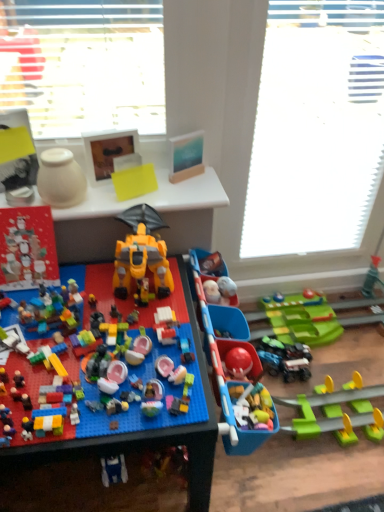
Question: Is yellow plastic robot at center, which appears as the 4th toy when viewed from the left, inside white matte vase at upper left, the second toy viewed from the left?

Choices:
 (A) no
 (B) yes

Answer: (A)

Question: Is white matte vase at upper left, the second toy viewed from the left, thinner than yellow plastic robot at center, which appears as the 4th toy when viewed from the left?

Choices:
 (A) yes
 (B) no

Answer: (A)

Question: Can we say white matte vase at upper left, the second toy viewed from the left, lies outside yellow plastic robot at center, acting as the second toy starting from the right?

Choices:
 (A) no
 (B) yes

Answer: (B)

Question: Is white matte vase at upper left, the second toy viewed from the left, positioned far away from yellow plastic robot at center, which appears as the 4th toy when viewed from the left?

Choices:
 (A) yes
 (B) no

Answer: (B)

Question: Is white matte vase at upper left, the second toy viewed from the left, in contact with yellow plastic robot at center, acting as the second toy starting from the right?

Choices:
 (A) no
 (B) yes

Answer: (A)

Question: From the image's perspective, is white matte vase at upper left, arranged as the 4th toy when viewed from the right, located above or below yellow plastic table at upper center?

Choices:
 (A) below
 (B) above

Answer: (B)

Question: Considering the relative positions of white matte vase at upper left, arranged as the 4th toy when viewed from the right, and yellow plastic table at upper center in the image provided, is white matte vase at upper left, arranged as the 4th toy when viewed from the right, to the left or to the right of yellow plastic table at upper center?

Choices:
 (A) right
 (B) left

Answer: (B)

Question: Considering the positions of point coord(41,174) and point coord(187,202), is point coord(41,174) closer or farther from the camera than point coord(187,202)?

Choices:
 (A) closer
 (B) farther

Answer: (A)

Question: In terms of size, does white matte vase at upper left, arranged as the 4th toy when viewed from the right, appear bigger or smaller than yellow plastic table at upper center?

Choices:
 (A) small
 (B) big

Answer: (A)

Question: Would you say white textured window screen at upper center is inside or outside translucent plastic spaceship at center, the 3th toy in the left-to-right sequence?

Choices:
 (A) inside
 (B) outside

Answer: (B)

Question: From a real-world perspective, is white textured window screen at upper center above or below translucent plastic spaceship at center, arranged as the third toy when viewed from the right?

Choices:
 (A) above
 (B) below

Answer: (A)

Question: Considering the positions of point (345, 113) and point (193, 408), is point (345, 113) closer or farther from the camera than point (193, 408)?

Choices:
 (A) farther
 (B) closer

Answer: (A)

Question: From the image's perspective, is white textured window screen at upper center above or below translucent plastic spaceship at center, the 3th toy in the left-to-right sequence?

Choices:
 (A) below
 (B) above

Answer: (B)

Question: Is yellow plastic robot at center, acting as the second toy starting from the right, inside or outside of white textured window screen at upper center?

Choices:
 (A) outside
 (B) inside

Answer: (A)

Question: Visually, is yellow plastic robot at center, acting as the second toy starting from the right, positioned to the left or to the right of white textured window screen at upper center?

Choices:
 (A) left
 (B) right

Answer: (A)